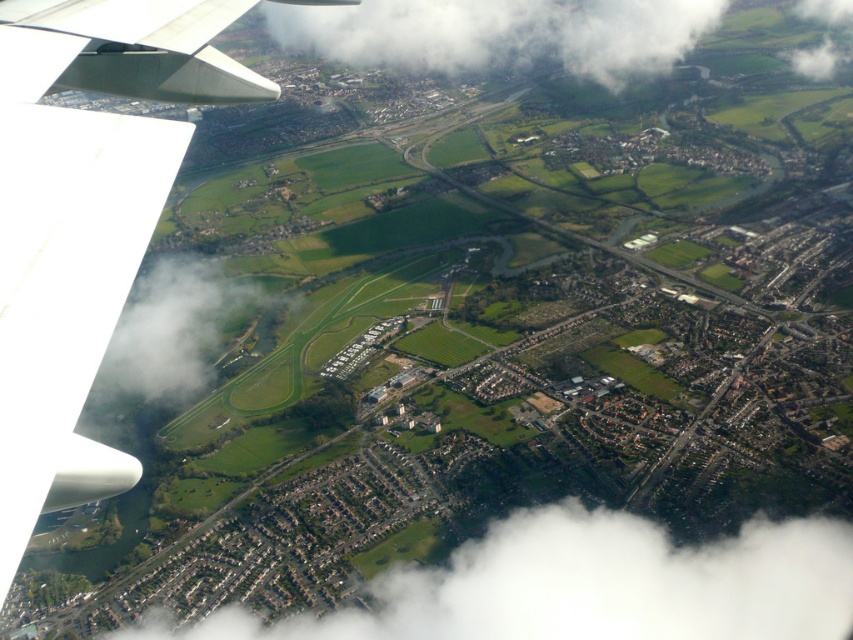
You are a pilot flying at an altitude of 3,000 meters. You notice a white fluffy cloud at lower center through the airplane window. Can you safely descend to 1,500 meters without entering the cloud?

The white fluffy cloud at lower center is 642.56 meters away from the viewer. Since the plane is currently at 3,000 meters altitude, descending to 1,500 meters would bring the plane 642.56 meters closer to the cloud. This means the plane would be 3,000 meters minus 1,500 meters equals 1,500 meters above the ground, but the cloud is only 642.56 meters away. Therefore, descending to 1,500 meters would put the plane inside the cloud or too close for safety. Pilots should maintain a safe distance from clouds to